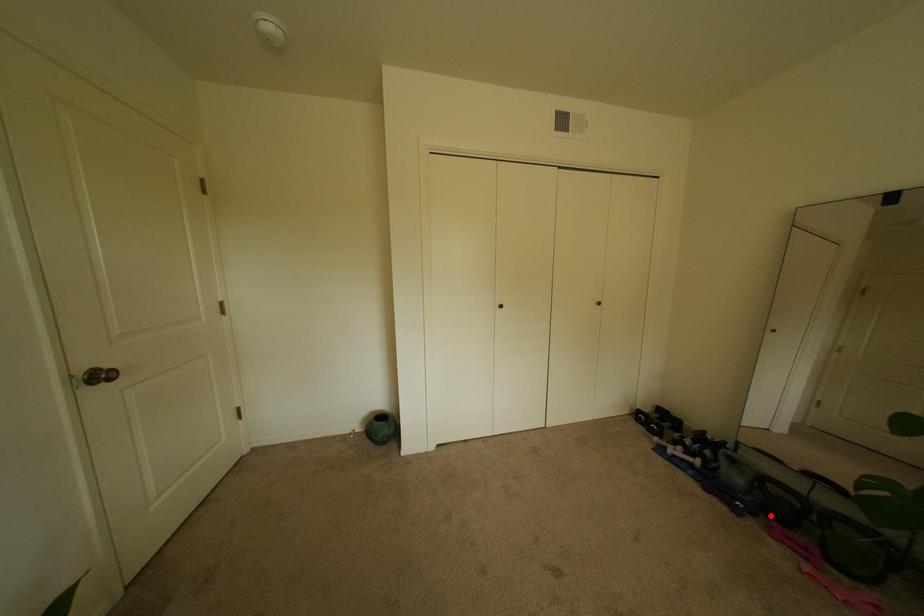
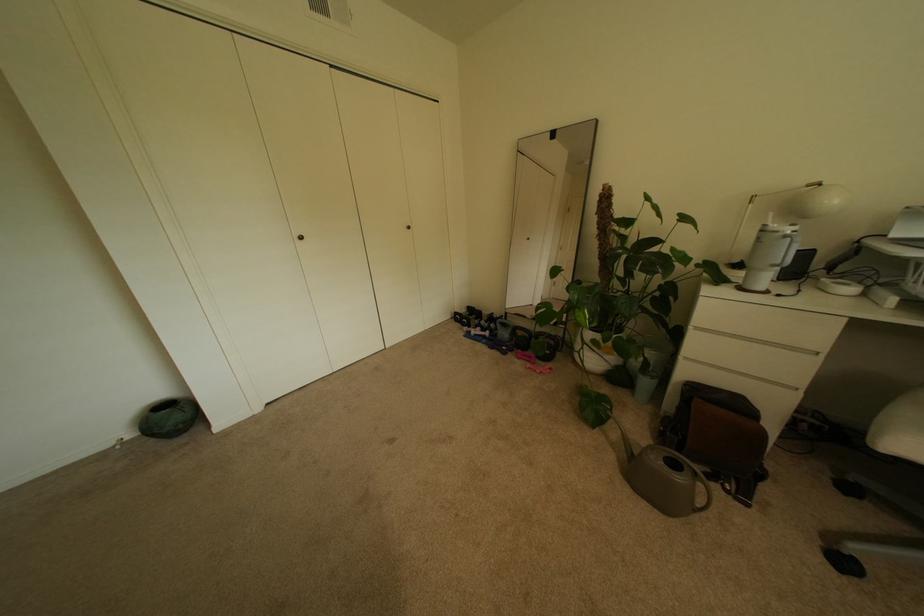
Locate, in the second image, the point that corresponds to the highlighted location in the first image.

(524, 350)